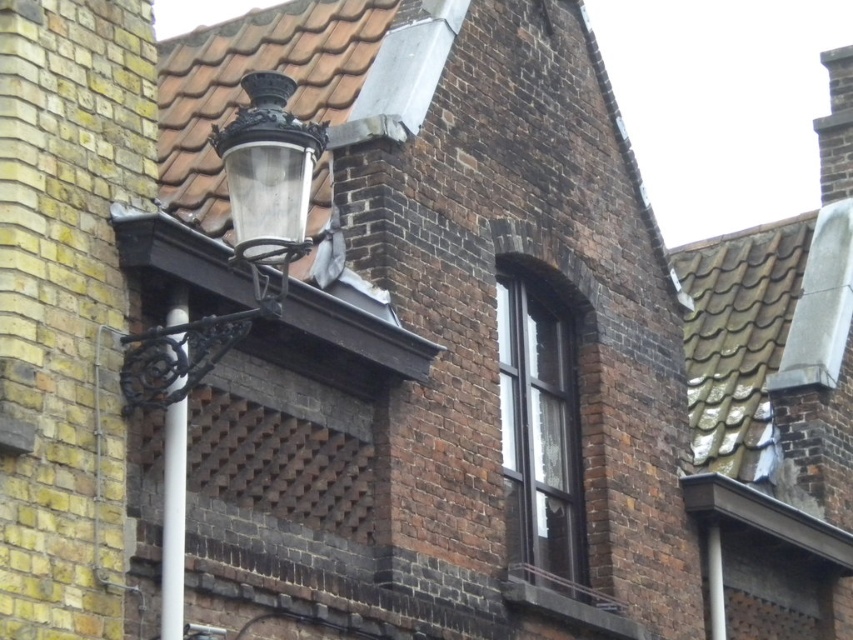
Question: Does polished brass lamp post at upper left appear on the right side of white plastic pole at left?

Choices:
 (A) yes
 (B) no

Answer: (B)

Question: Which object appears farthest from the camera in this image?

Choices:
 (A) polished brass lamp post at upper left
 (B) white plastic pole at left

Answer: (B)

Question: Which object appears farthest from the camera in this image?

Choices:
 (A) white plastic pole at left
 (B) black glass window at upper center
 (C) polished brass lamp post at upper left

Answer: (B)

Question: Does polished brass lamp post at upper left have a lesser width compared to black glass window at upper center?

Choices:
 (A) yes
 (B) no

Answer: (B)

Question: Does polished brass lamp post at upper left appear on the right side of black glass window at upper center?

Choices:
 (A) yes
 (B) no

Answer: (B)

Question: Which point is closer to the camera?

Choices:
 (A) black glass window at upper center
 (B) polished brass lamp post at upper left
 (C) white plastic pole at left

Answer: (B)